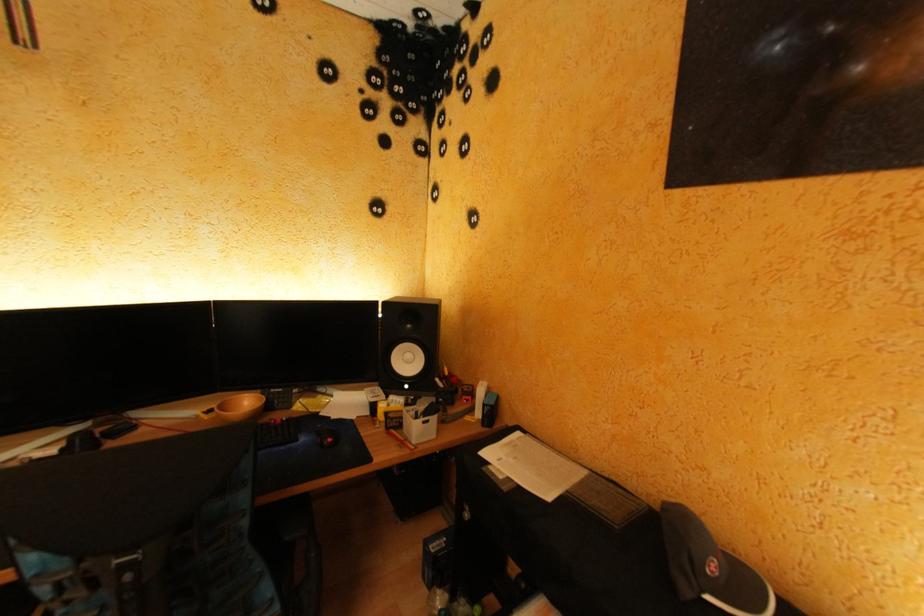
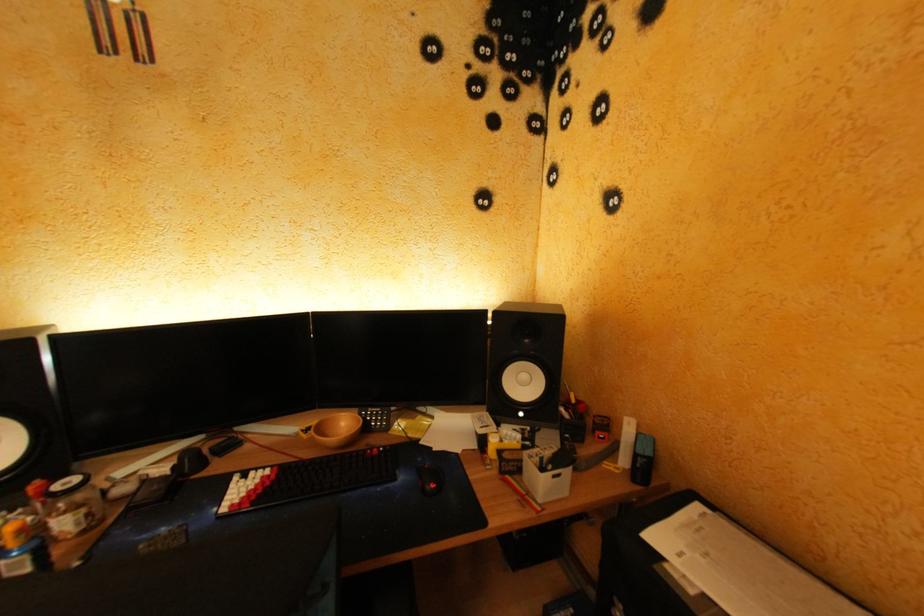
The images are taken continuously from a first-person perspective. In which direction are you moving?

The movement direction of the cameraman is left, forward.